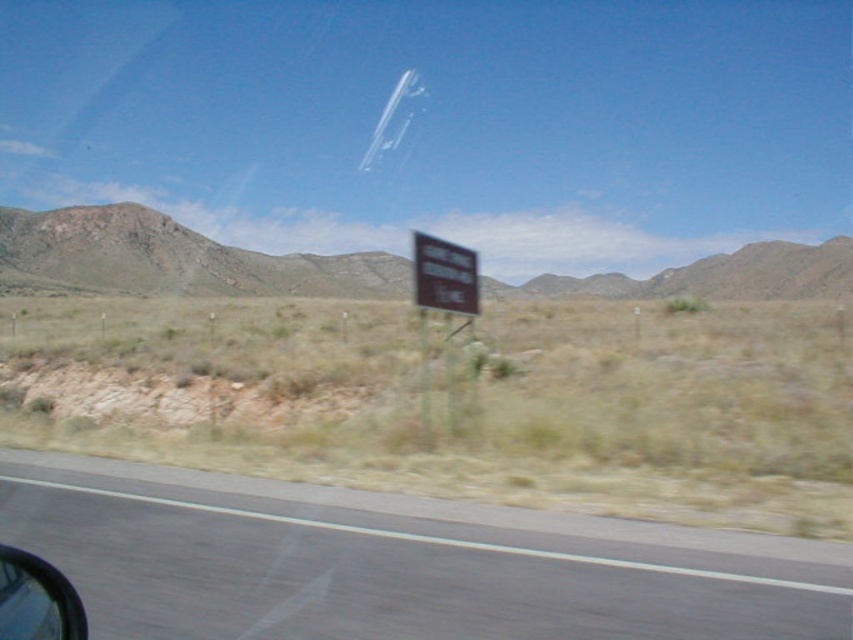
Question: Among these points, which one is farthest from the camera?

Choices:
 (A) (152, 504)
 (B) (424, 280)
 (C) (444, 243)
 (D) (757, 477)

Answer: (C)

Question: Is brown grassland at center positioned at the back of transparent plastic car window at lower left?

Choices:
 (A) yes
 (B) no

Answer: (A)

Question: Is brown grassland at center closer to camera compared to transparent plastic car window at lower left?

Choices:
 (A) yes
 (B) no

Answer: (B)

Question: Estimate the real-world distances between objects in this image. Which object is closer to the transparent plastic car window at lower left?

Choices:
 (A) metallic reflective sign at center
 (B) black asphalt road at lower center
 (C) brown rocky mountain at center

Answer: (B)

Question: Which object is positioned farthest from the metallic reflective sign at center?

Choices:
 (A) brown rocky mountain at center
 (B) brown matte sign at center
 (C) black asphalt road at lower center

Answer: (A)

Question: Does brown rocky mountain at center come in front of brown matte sign at center?

Choices:
 (A) no
 (B) yes

Answer: (A)